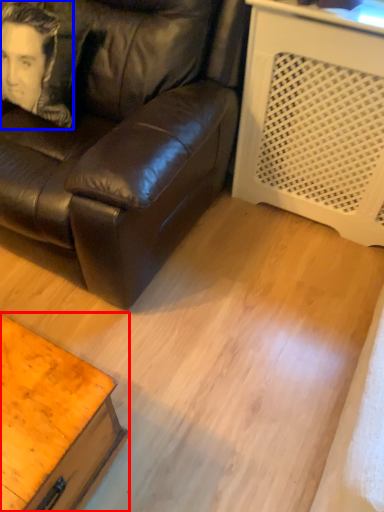
Question: Which of the following is the closest to the observer, table (highlighted by a red box) or man (highlighted by a blue box)?

Choices:
 (A) table
 (B) man

Answer: (A)